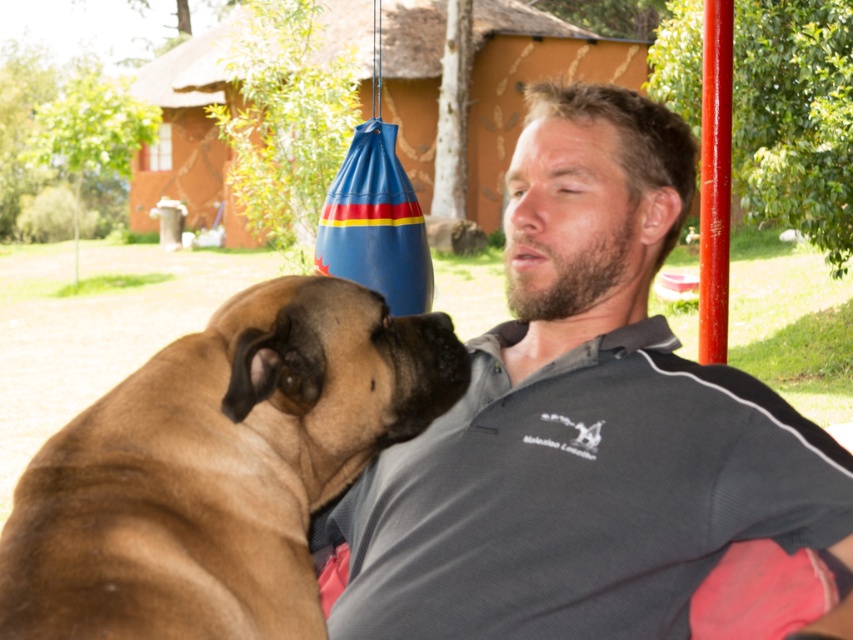
You are a delivery robot with a 60 cm wide package. You need to pass between the gray cotton polo shirt at center and the brown fur dog at left. Can the package fit through the space between them?

The distance between the gray cotton polo shirt at center and the brown fur dog at left is 58.71 centimeters. Since the package is 60 cm wide, it cannot fit through the space between them.

You are a photographer trying to capture a candid shot of the man and his dog. You need to ensure the gray cotton polo shirt at center and the brown fur dog at left are both in the frame. Based on their positions, which object is closer to the left edge of the photo?

The brown fur dog at left is closer to the left edge of the photo since it is positioned to the left of the gray cotton polo shirt at center.

What is the 2D coordinate of the gray cotton polo shirt at center in the image?

The gray cotton polo shirt at center is located at the 2D coordinate point of (583, 420).